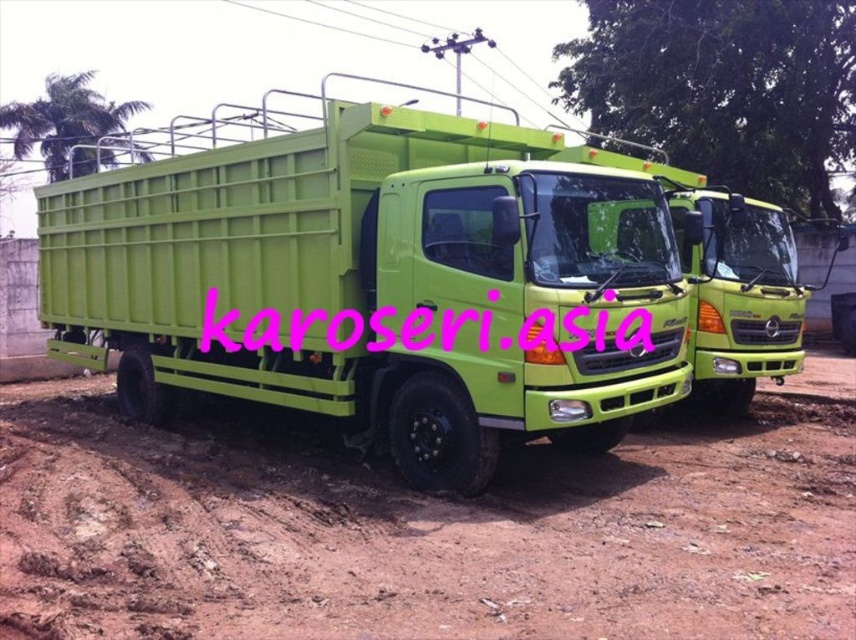
Is lime green plastic truck at center below brown dirt track at lower center?

No.

Is point (253, 400) behind point (732, 470)?

Yes, point (253, 400) is farther from viewer.

Does point (521, 317) come farther from viewer compared to point (840, 483)?

That is False.

The height and width of the screenshot is (640, 856). I want to click on lime green plastic truck at center, so click(x=379, y=284).